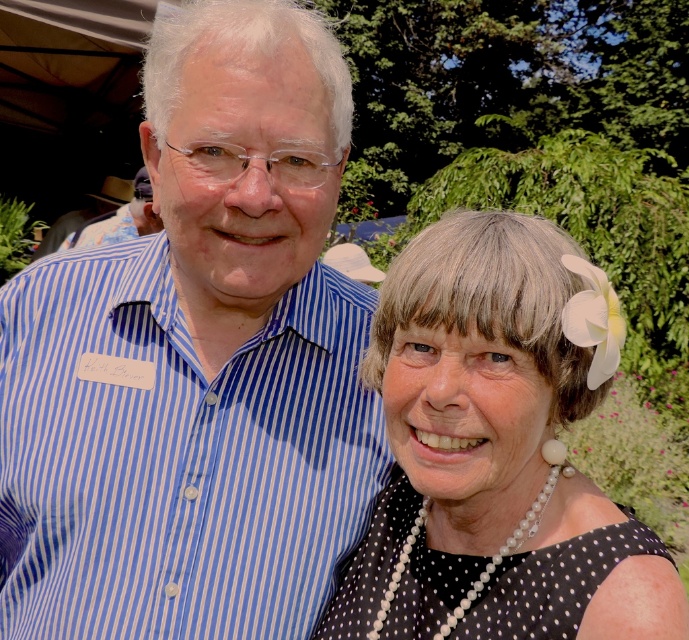
You are a photographer at a social event and need to capture a photo where both the blue striped shirt at left and the black dotted dress at center are visible. Considering their heights, which clothing item should be placed closer to the front to ensure both are fully visible in the frame?

The black dotted dress at center should be placed closer to the front since the blue striped shirt at left is much taller, allowing both to be visible without one blocking the other.

You are at a social event and want to greet the person wearing the blue striped shirt at left. Which direction should you move to approach them from the black dotted dress at center?

The blue striped shirt at left is above the black dotted dress at center, so you should move upward to approach the person wearing the blue striped shirt at left from the black dotted dress at center.

You are at a social event and want to introduce yourself to the person wearing the black dotted dress at center. Which direction should you move relative to the blue striped shirt at left?

The blue striped shirt at left is to the left of the black dotted dress at center, so you should move to the right from the blue striped shirt at left to reach the black dotted dress at center.